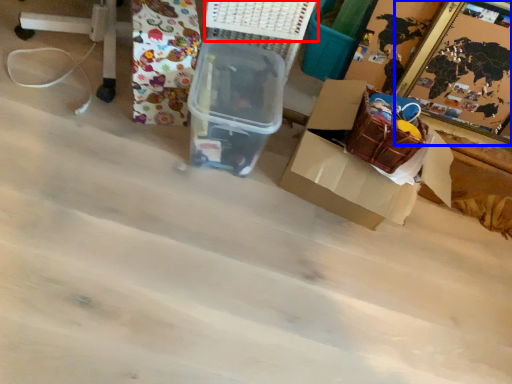
Question: Which object appears closest to the camera in this image, basket (highlighted by a red box) or picture frame (highlighted by a blue box)?

Choices:
 (A) basket
 (B) picture frame

Answer: (A)